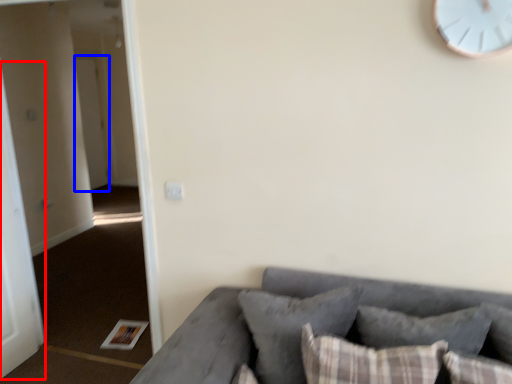
Question: Which object is further to the camera taking this photo, door (highlighted by a red box) or door (highlighted by a blue box)?

Choices:
 (A) door
 (B) door

Answer: (B)